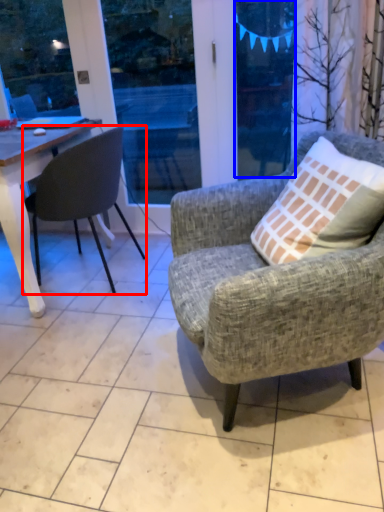
Question: Which object appears farthest to the camera in this image, chair (highlighted by a red box) or window screen (highlighted by a blue box)?

Choices:
 (A) chair
 (B) window screen

Answer: (B)